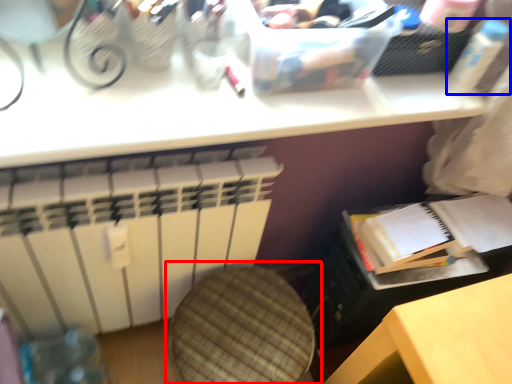
Question: Which of the following is the closest to the observer, swivel chair (highlighted by a red box) or bottle (highlighted by a blue box)?

Choices:
 (A) swivel chair
 (B) bottle

Answer: (A)